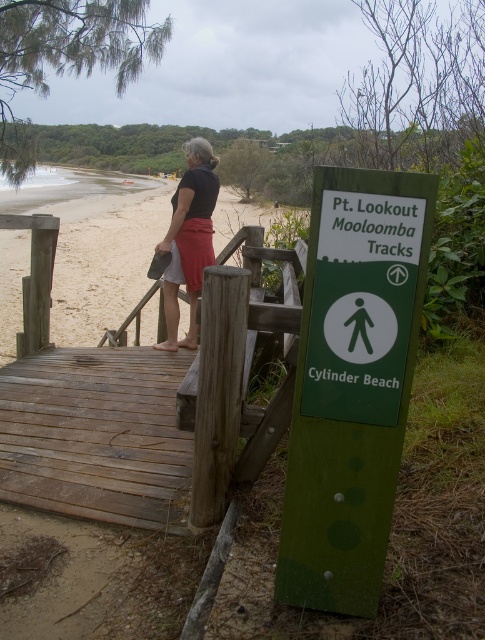
Is green matte sign at center wider than sandy beach at left?

In fact, green matte sign at center might be narrower than sandy beach at left.

Is green matte sign at center taller than sandy beach at left?

No.

Identify the location of green matte sign at center. This screenshot has height=640, width=485. (353, 384).

I want to click on green matte sign at center, so click(353, 384).

Is sandy beach at left further to camera compared to matte black shirt at center?

Yes, sandy beach at left is further from the viewer.

Is sandy beach at left bigger than matte black shirt at center?

Correct, sandy beach at left is larger in size than matte black shirt at center.

Between point (18, 294) and point (188, 288), which one is positioned behind?

Positioned behind is point (18, 294).

Where is `sandy beach at left`? sandy beach at left is located at coordinates (96, 243).

Does point (323, 323) lie behind point (195, 282)?

No, (323, 323) is in front of (195, 282).

Between green matte sign at center and matte black shirt at center, which one appears on the right side from the viewer's perspective?

green matte sign at center

Which is behind, point (388, 483) or point (184, 177)?

Positioned behind is point (184, 177).

This screenshot has height=640, width=485. What are the coordinates of `green matte sign at center` in the screenshot? It's located at (353, 384).